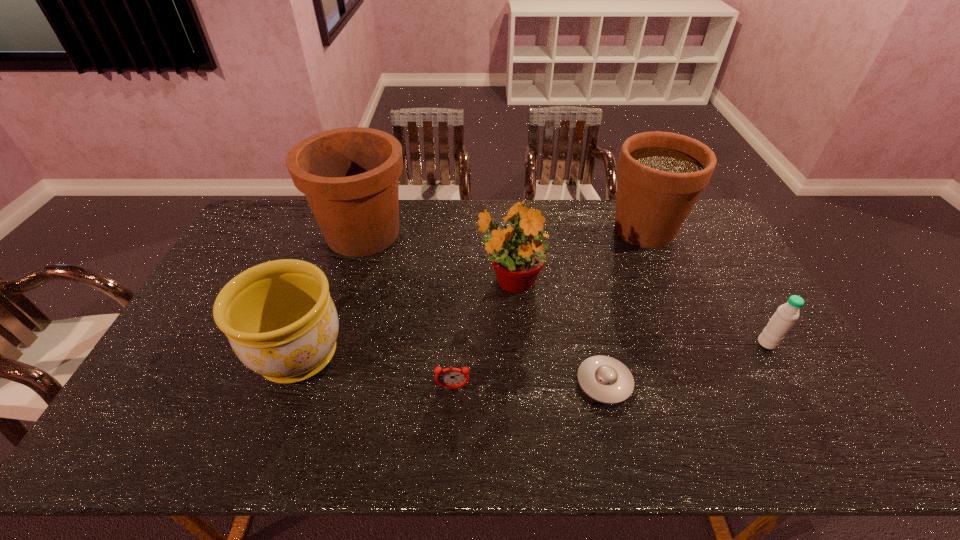
I want to click on vacant position at the left edge of the desktop, so click(x=264, y=256).

I want to click on vacant space at the right edge of the desktop, so click(x=740, y=268).

In order to click on vacant space at the far left corner in this screenshot , I will do `click(304, 200)`.

At what (x,y) coordinates should I click in order to perform the action: click on free space between the shortest flowerpot and the second object from right to left. Please return your answer as a coordinate pair (x, y). The width and height of the screenshot is (960, 540). Looking at the image, I should click on (471, 292).

Image resolution: width=960 pixels, height=540 pixels. In order to click on vacant area that lies between the nearest flowerpot and the rightmost flowerpot in this screenshot , I will do `click(471, 292)`.

Where is `vacant space in between the fourth object from right to left and the rightmost object`? Image resolution: width=960 pixels, height=540 pixels. vacant space in between the fourth object from right to left and the rightmost object is located at coordinates (638, 312).

This screenshot has width=960, height=540. Identify the location of unoccupied position between the second shortest object and the shortest object. (529, 385).

Locate an element on the screen. This screenshot has width=960, height=540. free space that is in between the nearest flowerpot and the alarm clock is located at coordinates (376, 372).

You are a GUI agent. You are given a task and a screenshot of the screen. Output one action in this format:
    pyautogui.click(x=<x>, y=<y>)
    Task: Click on the free space between the sixth tallest object and the shortest object
    This screenshot has width=960, height=540.
    Given the screenshot: What is the action you would take?
    pyautogui.click(x=529, y=385)

At what (x,y) coordinates should I click in order to perform the action: click on free space between the third flowerpot from left to right and the fifth tallest object. Please return your answer as a coordinate pair (x, y). This screenshot has width=960, height=540. Looking at the image, I should click on (638, 312).